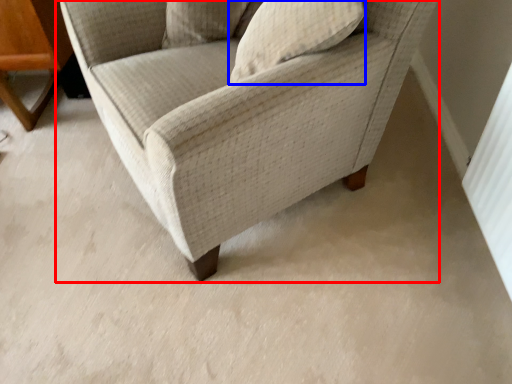
Question: Among these objects, which one is nearest to the camera, chair (highlighted by a red box) or pillow (highlighted by a blue box)?

Choices:
 (A) chair
 (B) pillow

Answer: (A)